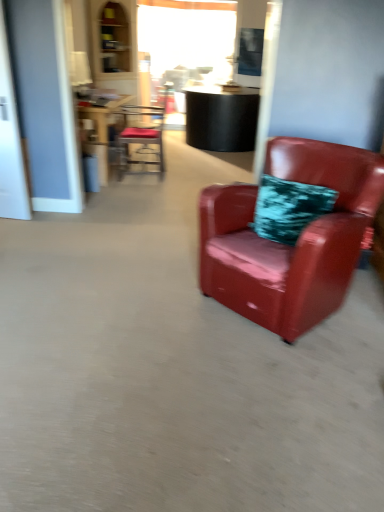
Measure the distance between point [20,207] and camera.

Point [20,207] is 3.32 meters away from camera.

This screenshot has width=384, height=512. Describe the element at coordinates (10, 141) in the screenshot. I see `transparent glass door at left` at that location.

Describe the element at coordinates (141, 138) in the screenshot. I see `metallic red chair at upper center, the second chair from the bottom` at that location.

What do you see at coordinates (98, 130) in the screenshot? I see `wooden table at center` at bounding box center [98, 130].

The height and width of the screenshot is (512, 384). In order to click on wooden table at center in this screenshot , I will do `click(98, 130)`.

The height and width of the screenshot is (512, 384). Find the location of `transparent glass door at left`. transparent glass door at left is located at coordinates (10, 141).

From the image's perspective, is wooden table at center beneath glossy leather armchair at right, the second chair in the back-to-front sequence?

No.

Image resolution: width=384 pixels, height=512 pixels. What are the coordinates of `chair lying in front of the wooden table at center` in the screenshot? It's located at (289, 246).

Looking at this image, from a real-world perspective, is wooden table at center over glossy leather armchair at right, acting as the 1th chair starting from the front?

No, from a real-world perspective, wooden table at center is not above glossy leather armchair at right, acting as the 1th chair starting from the front.

Is transparent glass door at left in front of or behind metallic red chair at upper center, which appears as the 1th chair when viewed from the left, in the image?

transparent glass door at left is in front of metallic red chair at upper center, which appears as the 1th chair when viewed from the left.

Considering the sizes of objects transparent glass door at left and metallic red chair at upper center, the second chair from the bottom, in the image provided, who is wider, transparent glass door at left or metallic red chair at upper center, the second chair from the bottom,?

metallic red chair at upper center, the second chair from the bottom, is wider.

At what (x,y) coordinates should I click in order to perform the action: click on chair above the transparent glass door at left (from the image's perspective). Please return your answer as a coordinate pair (x, y). Looking at the image, I should click on (x=141, y=138).

Is glossy leather armchair at right, the second chair in the back-to-front sequence, not near transparent glass door at left?

Indeed, glossy leather armchair at right, the second chair in the back-to-front sequence, is not near transparent glass door at left.

Can you tell me how much glossy leather armchair at right, which is the 2th chair in left-to-right order, and transparent glass door at left differ in facing direction?

The facing directions of glossy leather armchair at right, which is the 2th chair in left-to-right order, and transparent glass door at left are 39.4 degrees apart.

Relative to transparent glass door at left, is glossy leather armchair at right, which is counted as the 1th chair, starting from the bottom, in front or behind?

In the image, glossy leather armchair at right, which is counted as the 1th chair, starting from the bottom, appears in front of transparent glass door at left.

Can you confirm if glossy leather armchair at right, which is the second chair from top to bottom, is wider than transparent glass door at left?

Yes, glossy leather armchair at right, which is the second chair from top to bottom, is wider than transparent glass door at left.

What's the angular difference between transparent glass door at left and wooden table at center's facing directions?

They differ by 94.5 degrees in their facing directions.

From the image's perspective, which is below, transparent glass door at left or wooden table at center?

transparent glass door at left.

In the scene shown: Considering the sizes of objects transparent glass door at left and wooden table at center in the image provided, who is wider, transparent glass door at left or wooden table at center?

wooden table at center.

Is transparent glass door at left in front of wooden table at center?

Yes, the depth of transparent glass door at left is less than that of wooden table at center.

Is glossy leather armchair at right, acting as the 1th chair starting from the front, bigger than metallic red chair at upper center, which is counted as the first chair, starting from the back?

Yes.

Considering the positions of objects glossy leather armchair at right, acting as the 1th chair starting from the front, and metallic red chair at upper center, which is counted as the second chair, starting from the front, in the image provided, who is more to the left, glossy leather armchair at right, acting as the 1th chair starting from the front, or metallic red chair at upper center, which is counted as the second chair, starting from the front,?

Positioned to the left is metallic red chair at upper center, which is counted as the second chair, starting from the front.

In the scene shown: Could you tell me if glossy leather armchair at right, the second chair in the back-to-front sequence, is turned towards metallic red chair at upper center, which is counted as the second chair, starting from the front?

No.

This screenshot has height=512, width=384. There is a transparent glass door at left. In order to click on the 2nd chair below it (from a real-world perspective) in this screenshot , I will do `click(289, 246)`.

Can you confirm if transparent glass door at left is shorter than glossy leather armchair at right, which is the second chair from top to bottom?

No, transparent glass door at left is not shorter than glossy leather armchair at right, which is the second chair from top to bottom.

Measure the distance from transparent glass door at left to glossy leather armchair at right, which is counted as the 1th chair, starting from the bottom.

transparent glass door at left and glossy leather armchair at right, which is counted as the 1th chair, starting from the bottom, are 6.85 feet apart.

Considering the sizes of objects transparent glass door at left and glossy leather armchair at right, which is the 2th chair in left-to-right order, in the image provided, who is wider, transparent glass door at left or glossy leather armchair at right, which is the 2th chair in left-to-right order,?

glossy leather armchair at right, which is the 2th chair in left-to-right order, is wider.

How much distance is there between wooden table at center and metallic red chair at upper center, which is the 2th chair from right to left?

They are 14.98 inches apart.

Does point (85, 119) come in front of point (136, 138)?

Yes, it is.

From a real-world perspective, is wooden table at center beneath metallic red chair at upper center, which is the 2th chair from right to left?

Yes.

How many degrees apart are the facing directions of wooden table at center and metallic red chair at upper center, which is counted as the first chair, starting from the back?

The angle between the facing direction of wooden table at center and the facing direction of metallic red chair at upper center, which is counted as the first chair, starting from the back, is 174 degrees.

Where is `chair that is the 2nd one when counting downward from the wooden table at center (from the image's perspective)`? The height and width of the screenshot is (512, 384). chair that is the 2nd one when counting downward from the wooden table at center (from the image's perspective) is located at coordinates (289, 246).

You are a GUI agent. You are given a task and a screenshot of the screen. Output one action in this format:
    pyautogui.click(x=<x>, y=<y>)
    Task: Click on the chair above the transparent glass door at left (from the image's perspective)
    The height and width of the screenshot is (512, 384).
    Given the screenshot: What is the action you would take?
    pyautogui.click(x=141, y=138)

Looking at the image, which one is located closer to transparent glass door at left, glossy leather armchair at right, the second chair in the back-to-front sequence, or metallic red chair at upper center, the second chair from the bottom?

metallic red chair at upper center, the second chair from the bottom, lies closer to transparent glass door at left than the other object.

Looking at this image, considering their positions, is transparent glass door at left positioned closer to glossy leather armchair at right, which is counted as the 1th chair, starting from the bottom, than metallic red chair at upper center, which is the 2th chair from right to left?

transparent glass door at left is closer to glossy leather armchair at right, which is counted as the 1th chair, starting from the bottom.

Estimate the real-world distances between objects in this image. Which object is further from wooden table at center, metallic red chair at upper center, the second chair from the bottom, or transparent glass door at left?

The object further to wooden table at center is transparent glass door at left.

From the image, which object appears to be nearer to metallic red chair at upper center, which appears as the 1th chair when viewed from the left, transparent glass door at left or wooden table at center?

wooden table at center lies closer to metallic red chair at upper center, which appears as the 1th chair when viewed from the left, than the other object.

From the picture: From the image, which object appears to be nearer to glossy leather armchair at right, the second chair in the back-to-front sequence, metallic red chair at upper center, which is counted as the second chair, starting from the front, or wooden table at center?

Among the two, wooden table at center is located nearer to glossy leather armchair at right, the second chair in the back-to-front sequence.

From the image, which object appears to be nearer to wooden table at center, glossy leather armchair at right, which is the 2th chair in left-to-right order, or transparent glass door at left?

transparent glass door at left.

Based on their spatial positions, is metallic red chair at upper center, which is counted as the second chair, starting from the front, or wooden table at center further from transparent glass door at left?

Based on the image, metallic red chair at upper center, which is counted as the second chair, starting from the front, appears to be further to transparent glass door at left.

Based on their spatial positions, is glossy leather armchair at right, which is the second chair from top to bottom, or wooden table at center closer to metallic red chair at upper center, which is the 2th chair from right to left?

wooden table at center lies closer to metallic red chair at upper center, which is the 2th chair from right to left, than the other object.

Where is `table positioned between transparent glass door at left and metallic red chair at upper center, which is the 2th chair from right to left, from near to far`? table positioned between transparent glass door at left and metallic red chair at upper center, which is the 2th chair from right to left, from near to far is located at coordinates (98, 130).

Image resolution: width=384 pixels, height=512 pixels. What are the coordinates of `glass door between glossy leather armchair at right, which is the 2th chair in left-to-right order, and metallic red chair at upper center, which is counted as the second chair, starting from the front, along the z-axis` in the screenshot? It's located at (10, 141).

I want to click on table located between glossy leather armchair at right, which is counted as the 1th chair, starting from the bottom, and metallic red chair at upper center, the second chair from the bottom, in the depth direction, so click(x=98, y=130).

This screenshot has height=512, width=384. I want to click on glass door between glossy leather armchair at right, which is counted as the 1th chair, starting from the bottom, and wooden table at center from front to back, so click(10, 141).